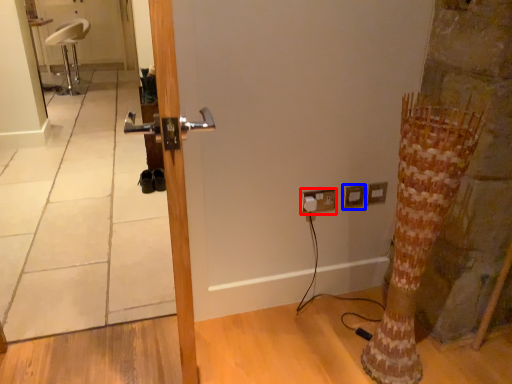
Question: Which object is further to the camera taking this photo, electric outlet (highlighted by a red box) or electric outlet (highlighted by a blue box)?

Choices:
 (A) electric outlet
 (B) electric outlet

Answer: (B)